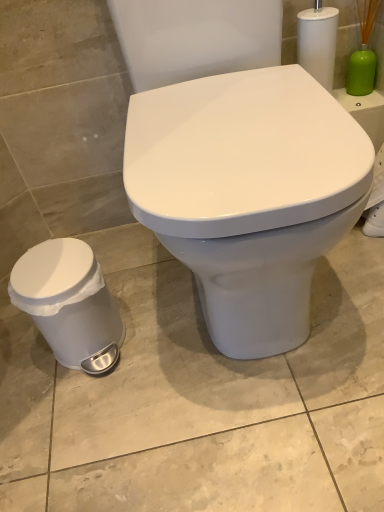
Where is `free point in front of white glossy toilet at center`? free point in front of white glossy toilet at center is located at coordinates click(240, 420).